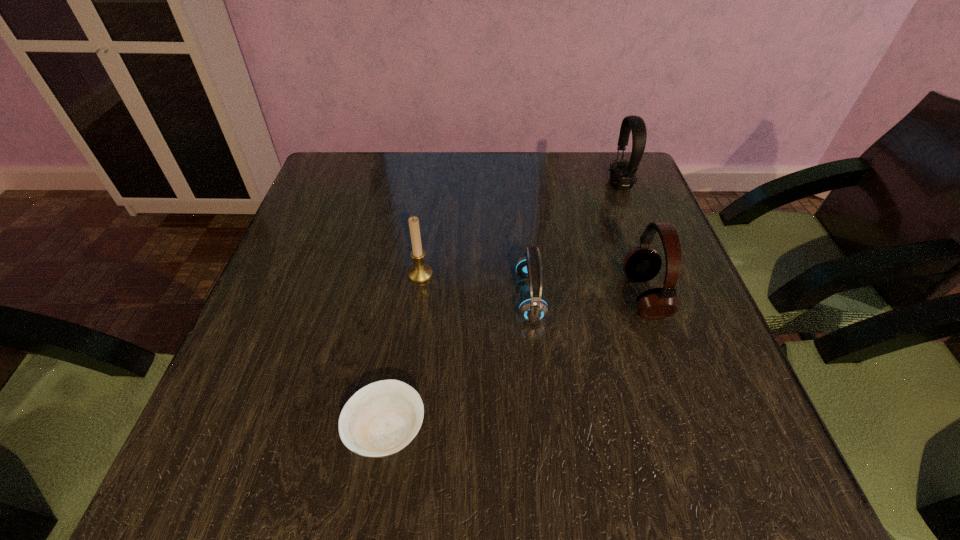
You are a GUI agent. You are given a task and a screenshot of the screen. Output one action in this format:
    pyautogui.click(x=<x>, y=<y>)
    Task: Click on the free spot located 0.160m on the ear cups of the shortest headset
    
    Given the screenshot: What is the action you would take?
    pyautogui.click(x=438, y=298)

This screenshot has width=960, height=540. In order to click on vacant space located 0.390m on the ear cups of the shortest headset in this screenshot , I will do (x=325, y=298).

The image size is (960, 540). I want to click on vacant space situated 0.090m on the ear cups of the shortest headset, so click(472, 298).

Where is `free space located 0.340m on the back of the shortest object`? free space located 0.340m on the back of the shortest object is located at coordinates (413, 256).

Find the location of `object that is positioned at the far edge`. object that is positioned at the far edge is located at coordinates (622, 173).

You are a GUI agent. You are given a task and a screenshot of the screen. Output one action in this format:
    pyautogui.click(x=<x>, y=<y>)
    Task: Click on the object at the near edge
    Image resolution: width=960 pixels, height=540 pixels.
    Given the screenshot: What is the action you would take?
    pyautogui.click(x=381, y=419)

Image resolution: width=960 pixels, height=540 pixels. In order to click on object that is at the far right corner in this screenshot , I will do `click(622, 173)`.

What are the coordinates of `free space at the far edge of the desktop` in the screenshot? It's located at (540, 197).

Where is `vacant space at the near edge of the desktop`? The height and width of the screenshot is (540, 960). vacant space at the near edge of the desktop is located at coordinates (450, 451).

You are a GUI agent. You are given a task and a screenshot of the screen. Output one action in this format:
    pyautogui.click(x=<x>, y=<y>)
    Task: Click on the vacant position at the left edge of the desktop
    
    Given the screenshot: What is the action you would take?
    pyautogui.click(x=265, y=296)